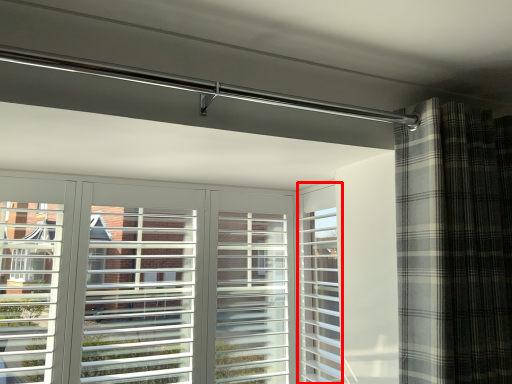
Question: In this image, where is screen door (annotated by the red box) located relative to curtain?

Choices:
 (A) right
 (B) left

Answer: (B)